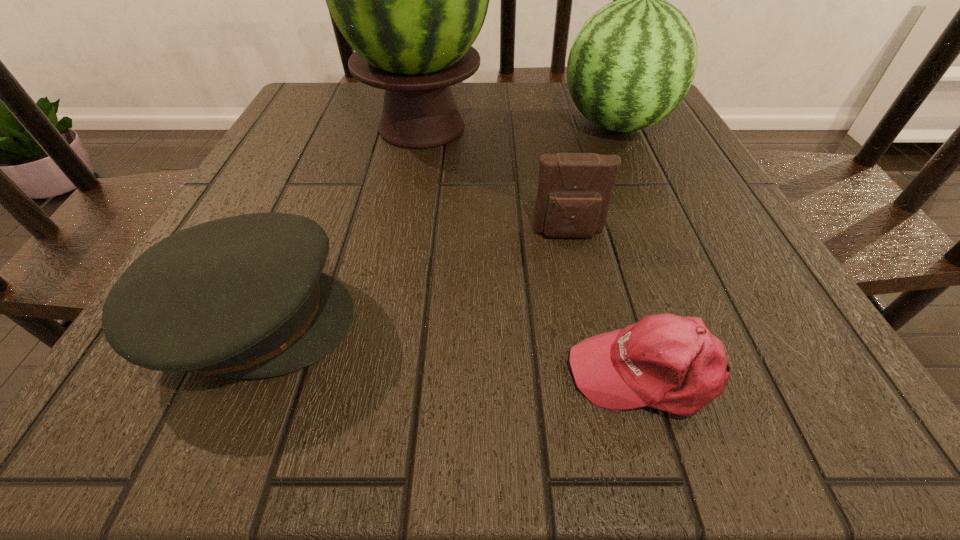
This screenshot has height=540, width=960. In order to click on object identified as the second closest to the tallest object in this screenshot , I will do `click(574, 194)`.

Where is `object that is the third closest one to the beret`? This screenshot has width=960, height=540. object that is the third closest one to the beret is located at coordinates (672, 363).

Where is `vacant area that satisfies the following two spatial constraints: 1. with an open flap on the third nearest object; 2. on the front-facing side of the beret`? The width and height of the screenshot is (960, 540). vacant area that satisfies the following two spatial constraints: 1. with an open flap on the third nearest object; 2. on the front-facing side of the beret is located at coordinates (587, 320).